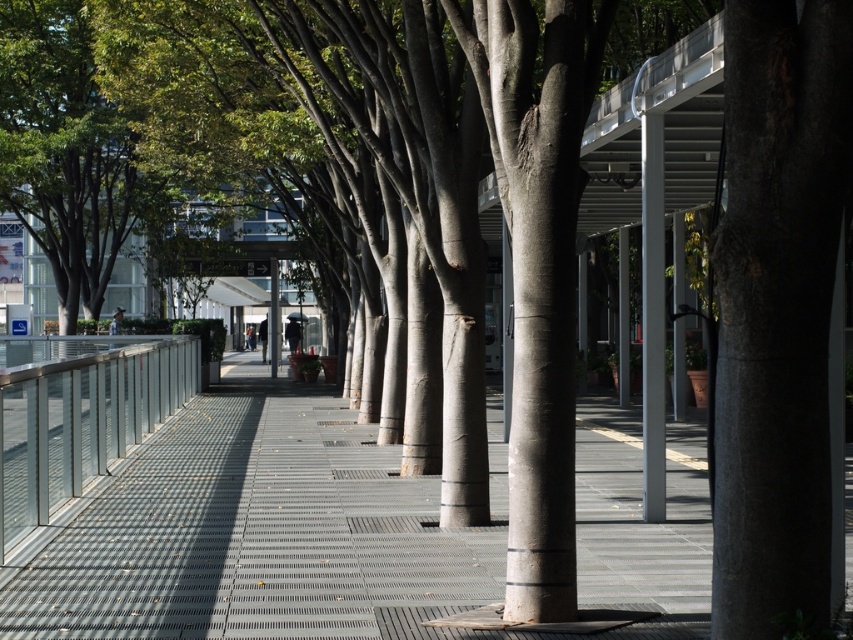
Question: Based on their relative distances, which object is farther from the metallic grid pavement at center?

Choices:
 (A) smooth gray tree trunk at center
 (B) metallic gray pole at center

Answer: (A)

Question: Which object is closer to the camera taking this photo?

Choices:
 (A) smooth gray tree trunk at center
 (B) metallic gray pole at center
 (C) metallic grid pavement at center

Answer: (A)

Question: Considering the relative positions of smooth gray tree trunk at center and metallic gray pole at center in the image provided, where is smooth gray tree trunk at center located with respect to metallic gray pole at center?

Choices:
 (A) above
 (B) below

Answer: (B)

Question: From the image, what is the correct spatial relationship of metallic grid pavement at center in relation to metallic gray pole at center?

Choices:
 (A) right
 (B) left

Answer: (B)

Question: Considering the real-world distances, which object is farthest from the metallic grid pavement at center?

Choices:
 (A) metallic gray pole at center
 (B) smooth gray tree trunk at center

Answer: (B)

Question: Can you confirm if smooth gray tree trunk at center is positioned to the left of metallic gray pole at center?

Choices:
 (A) yes
 (B) no

Answer: (A)